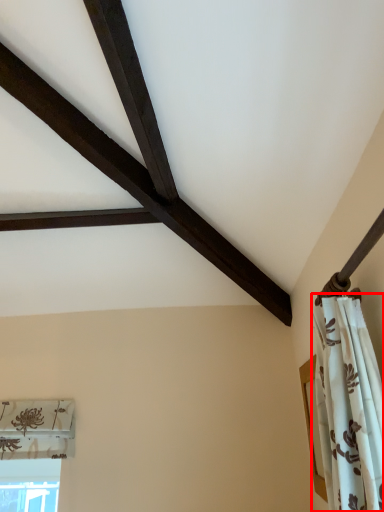
Question: Where is curtain (annotated by the red box) located in relation to window in the image?

Choices:
 (A) right
 (B) left

Answer: (A)